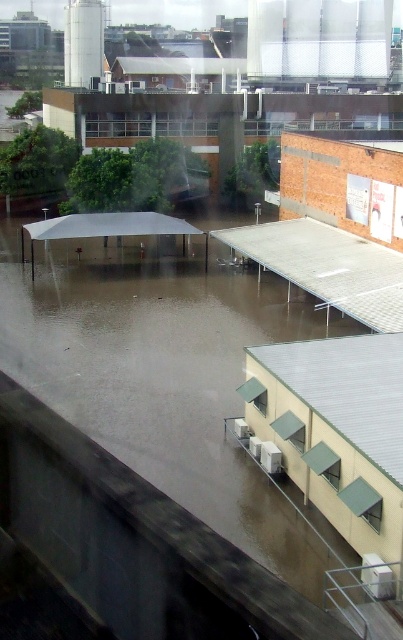
Question: Does brown/muddy water at center have a smaller size compared to metallic silver awning at center?

Choices:
 (A) no
 (B) yes

Answer: (A)

Question: Can you confirm if brown/muddy water at center is thinner than metallic silver awning at center?

Choices:
 (A) no
 (B) yes

Answer: (A)

Question: Can you confirm if brown/muddy water at center is smaller than metallic silver awning at center?

Choices:
 (A) no
 (B) yes

Answer: (A)

Question: Which of the following is the closest to the observer?

Choices:
 (A) (324, 282)
 (B) (151, 404)

Answer: (B)